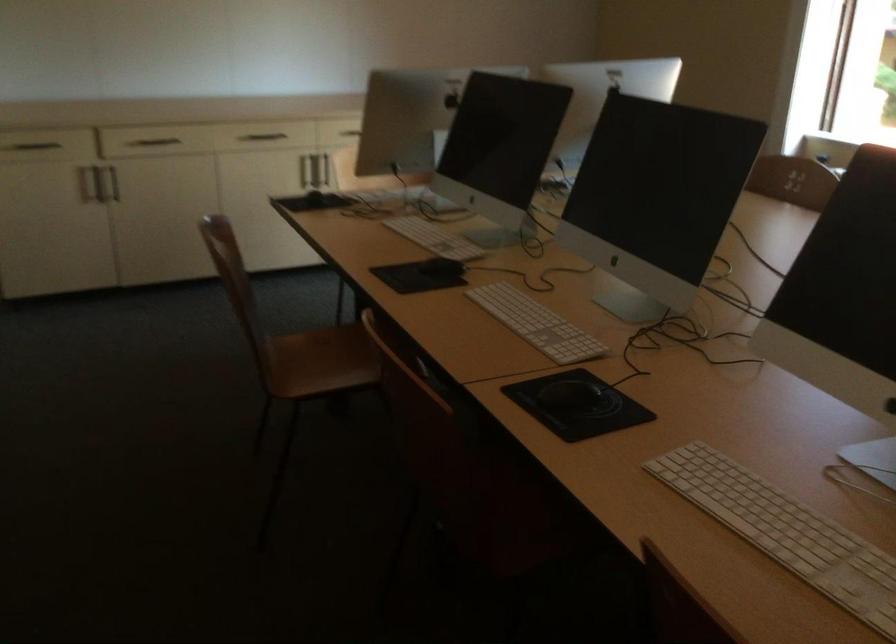
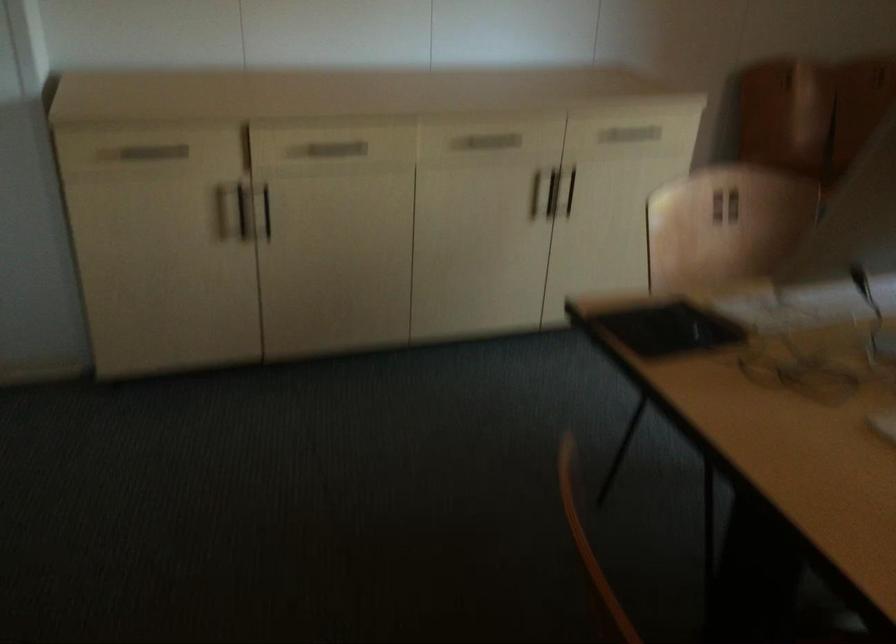
Find the pixel in the second image that matches [314,199] in the first image.

(668, 328)